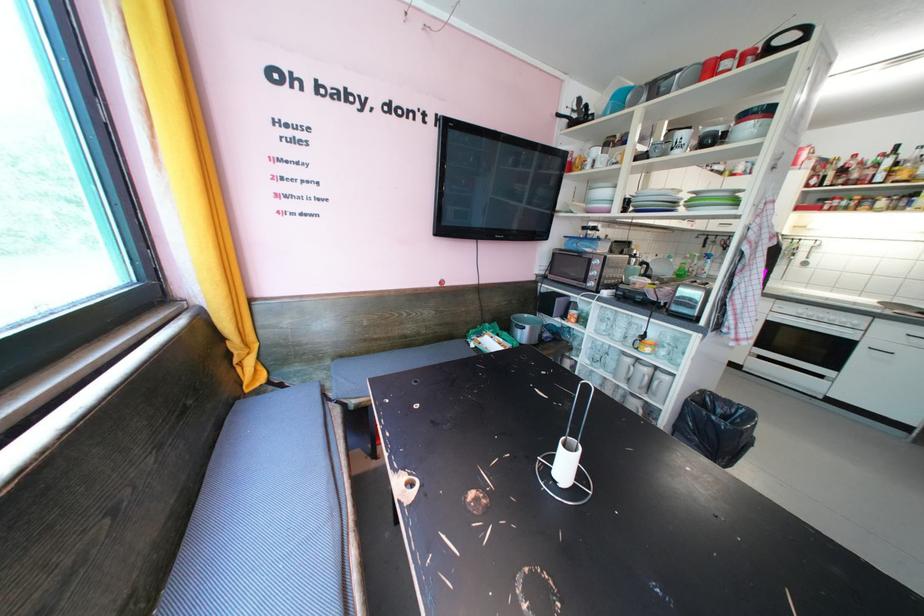
Where would you lift the middle white mug handle? Please return your answer as a coordinate pair (x, y).

(641, 378)